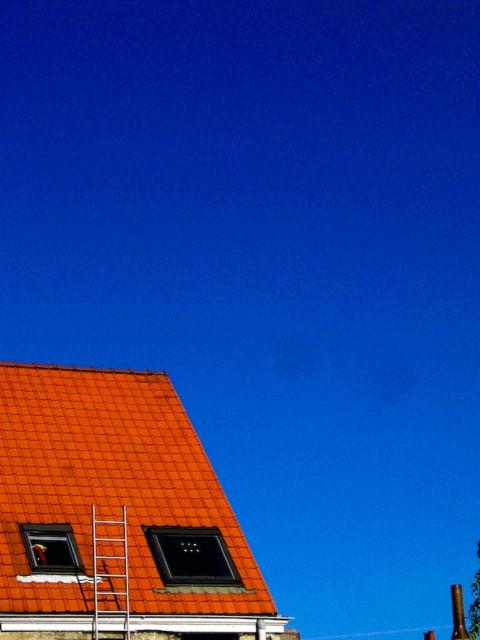
You are a construction worker who needs to place a safety net between the orange clay tiles at lower left and the metallic silver ladder at upper left. Which object requires the safety net to be closer to it because of its size?

The orange clay tiles at lower left has a larger size compared to the metallic silver ladder at upper left, so the safety net should be placed closer to the metallic silver ladder at upper left to ensure proper coverage.

You are standing on the ground looking at the orange tiled roof. There are two points marked on the roof. Which point is closer to you, point (106, 404) or point (94, 636)?

Point (106, 404) is closer to you because it is further to the viewer than point (94, 636).